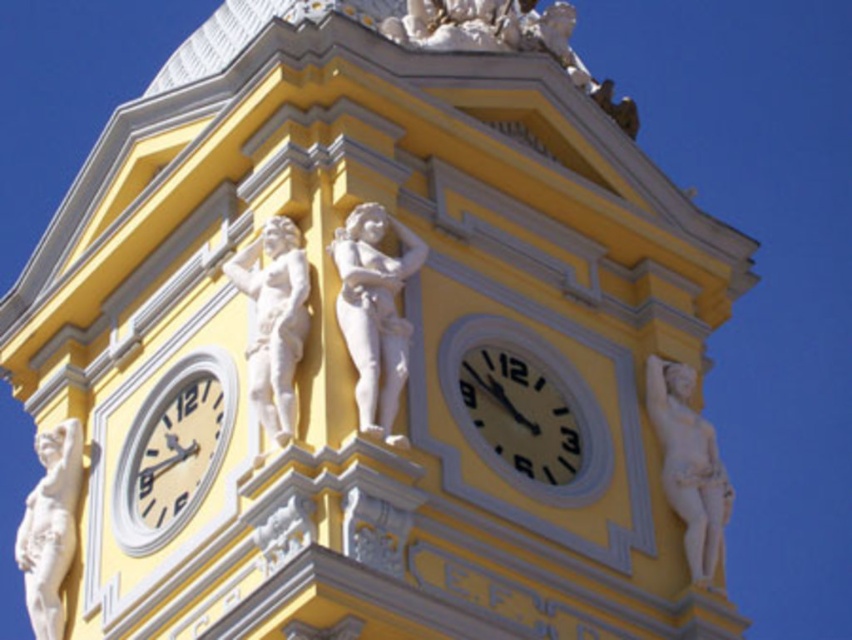
Does white marble statue at right have a smaller size compared to white marble statue at lower left?

Correct, white marble statue at right occupies less space than white marble statue at lower left.

Where is `white marble statue at right`? This screenshot has width=852, height=640. white marble statue at right is located at coordinates (688, 465).

Is white marble statue at upper center smaller than white marble statue at lower left?

Yes, white marble statue at upper center is smaller than white marble statue at lower left.

Who is taller, white marble statue at upper center or white marble statue at lower left?

white marble statue at lower left is taller.

Which is in front, point (281, 269) or point (68, 550)?

Point (281, 269)

At what (x,y) coordinates should I click in order to perform the action: click on white marble statue at upper center. Please return your answer as a coordinate pair (x, y). The height and width of the screenshot is (640, 852). Looking at the image, I should click on (273, 321).

Can you confirm if matte yellow clock at center is positioned above white marble statue at upper center?

No.

Does matte yellow clock at center have a greater height compared to white marble statue at upper center?

Yes.

Who is more distant from viewer, (563, 444) or (303, 342)?

The point (563, 444) is behind.

The width and height of the screenshot is (852, 640). Find the location of `matte yellow clock at center`. matte yellow clock at center is located at coordinates (525, 410).